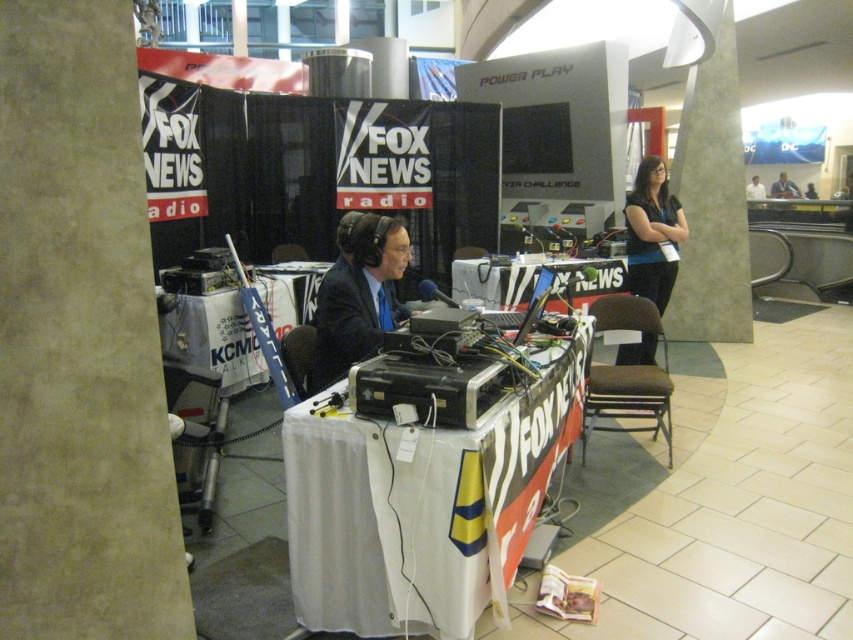
Question: Among these points, which one is nearest to the camera?

Choices:
 (A) (747, 196)
 (B) (433, 561)
 (C) (643, 168)
 (D) (793, 189)

Answer: (B)

Question: Does white fabric table at center have a greater width compared to matte black suit at center?

Choices:
 (A) no
 (B) yes

Answer: (B)

Question: Is blue denim shirt at right thinner than smooth black shirt at upper right?

Choices:
 (A) yes
 (B) no

Answer: (A)

Question: Which point appears farthest from the camera in this image?

Choices:
 (A) (383, 529)
 (B) (631, 205)

Answer: (B)

Question: Which of the following is the farthest from the observer?

Choices:
 (A) (669, 243)
 (B) (363, 506)
 (C) (341, 291)
 (D) (793, 195)

Answer: (D)

Question: Can you confirm if white fabric table at center is positioned to the left of smooth black shirt at upper right?

Choices:
 (A) yes
 (B) no

Answer: (A)